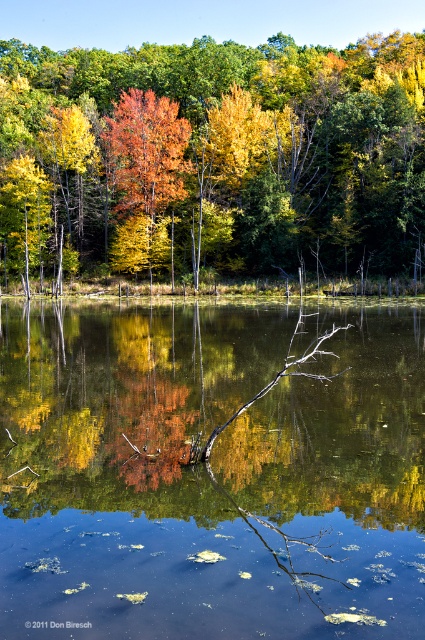
Between point (215, 410) and point (175, 173), which one is positioned in front?

Point (215, 410) is more forward.

Which is below, green reflective water at center or shiny orange tree at center?

green reflective water at center is below.

Is point (340, 632) positioned in front of point (133, 134)?

Yes, point (340, 632) is in front of point (133, 134).

Where is `green reflective water at center`? This screenshot has height=640, width=425. green reflective water at center is located at coordinates (209, 474).

Who is more distant from viewer, (169, 96) or (124, 172)?

Point (169, 96)

In the scene shown: Does orange leafy tree at center have a greater width compared to shiny orange tree at center?

Yes, orange leafy tree at center is wider than shiny orange tree at center.

Who is more forward, (175, 180) or (184, 136)?

Point (184, 136) is in front.

This screenshot has width=425, height=640. Identify the location of orange leafy tree at center. pos(218,150).

Describe the element at coordinates (209, 474) in the screenshot. I see `green reflective water at center` at that location.

Between point (396, 305) and point (379, 256), which one is positioned in front?

Point (396, 305) is more forward.

The image size is (425, 640). I want to click on green reflective water at center, so click(209, 474).

This screenshot has width=425, height=640. I want to click on green reflective water at center, so click(x=209, y=474).